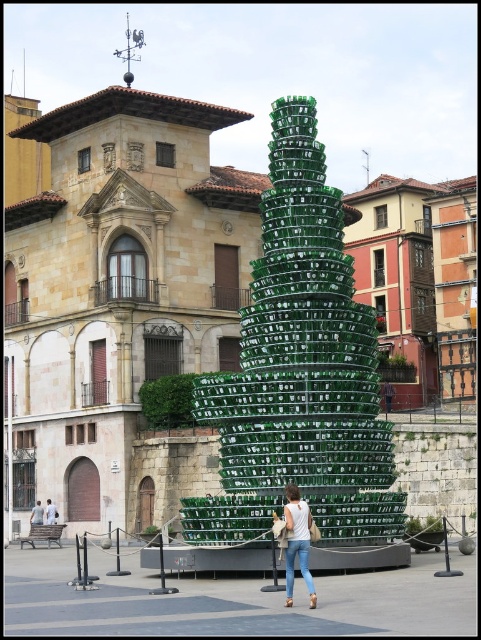
Question: Based on their relative distances, which object is nearer to the green glass christmas tree at center?

Choices:
 (A) white denim jeans at lower center
 (B) white cotton shirts at center

Answer: (A)

Question: Can you confirm if white denim jeans at lower center is smaller than white cotton shirts at center?

Choices:
 (A) no
 (B) yes

Answer: (A)

Question: Observing the image, what is the correct spatial positioning of green glass christmas tree at center in reference to white denim jeans at lower center?

Choices:
 (A) below
 (B) above

Answer: (B)

Question: Estimate the real-world distances between objects in this image. Which object is closer to the white denim jeans at lower center?

Choices:
 (A) white cotton shirts at center
 (B) green glass christmas tree at center

Answer: (B)

Question: Observing the image, what is the correct spatial positioning of white denim jeans at lower center in reference to white cotton shirts at center?

Choices:
 (A) left
 (B) right

Answer: (B)

Question: Among these objects, which one is farthest from the camera?

Choices:
 (A) white cotton shirts at center
 (B) white denim jeans at lower center

Answer: (A)